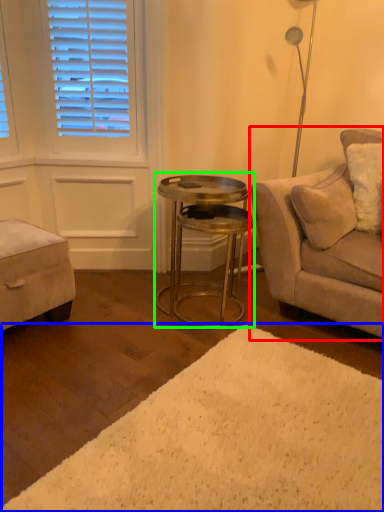
Question: Which object is positioned closest to studio couch (highlighted by a red box)? Select from plain (highlighted by a blue box) and table (highlighted by a green box).

Choices:
 (A) plain
 (B) table

Answer: (B)